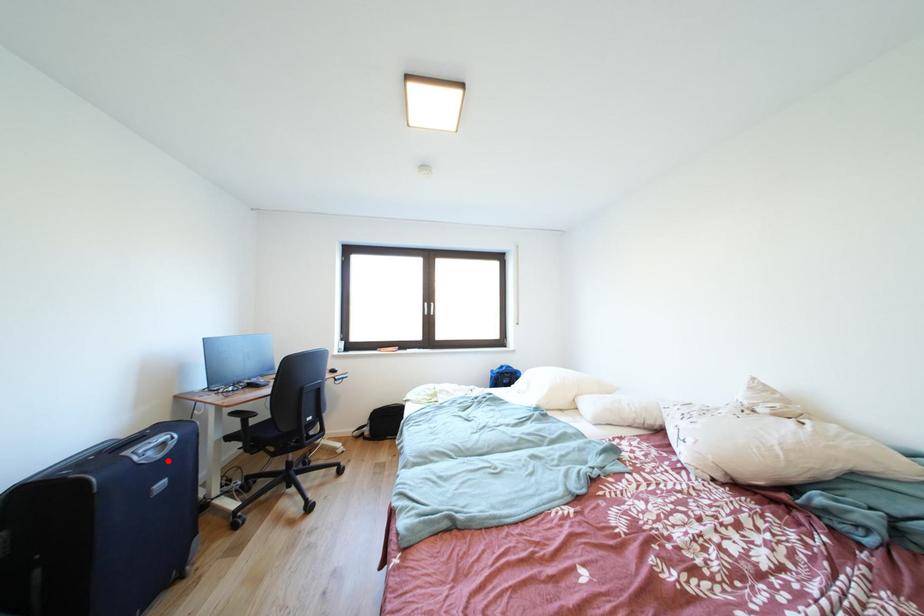
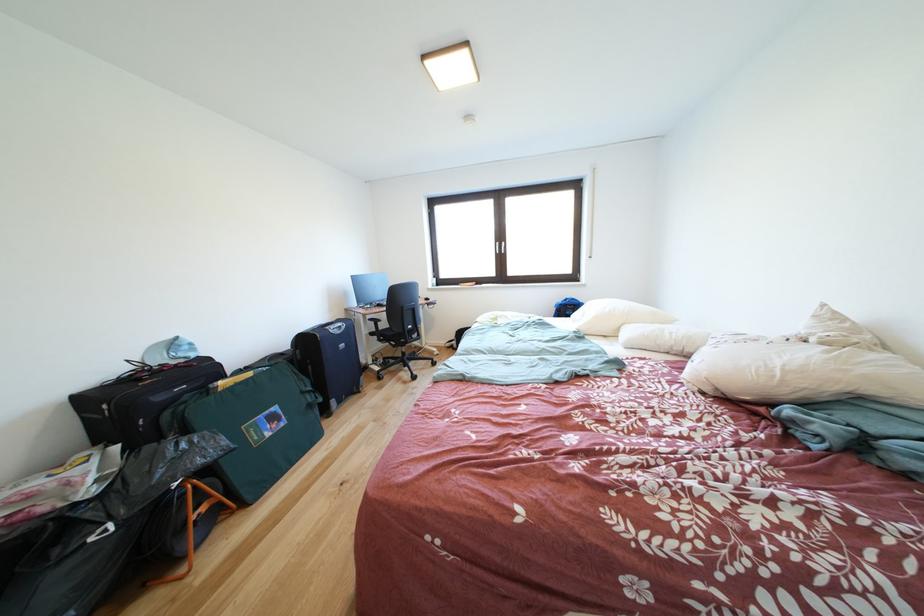
The point at the highlighted location is marked in the first image. Where is the corresponding point in the second image?

(347, 337)